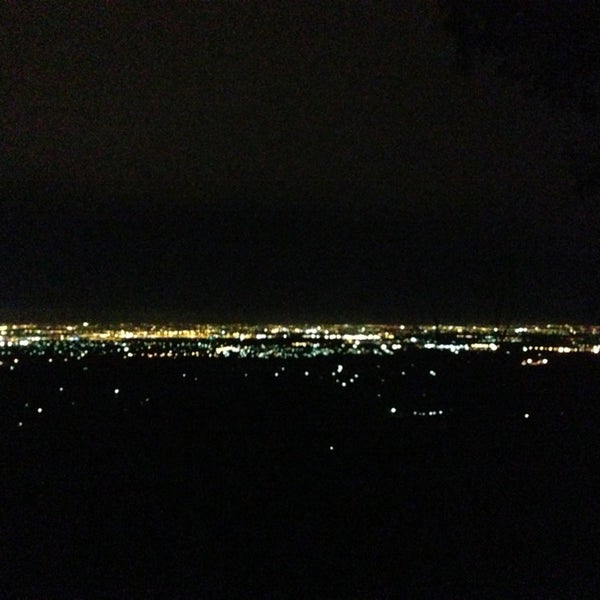
The image size is (600, 600). Find the location of `empty space below lights`. empty space below lights is located at coordinates (78, 516), (233, 512), (373, 512), (501, 514).